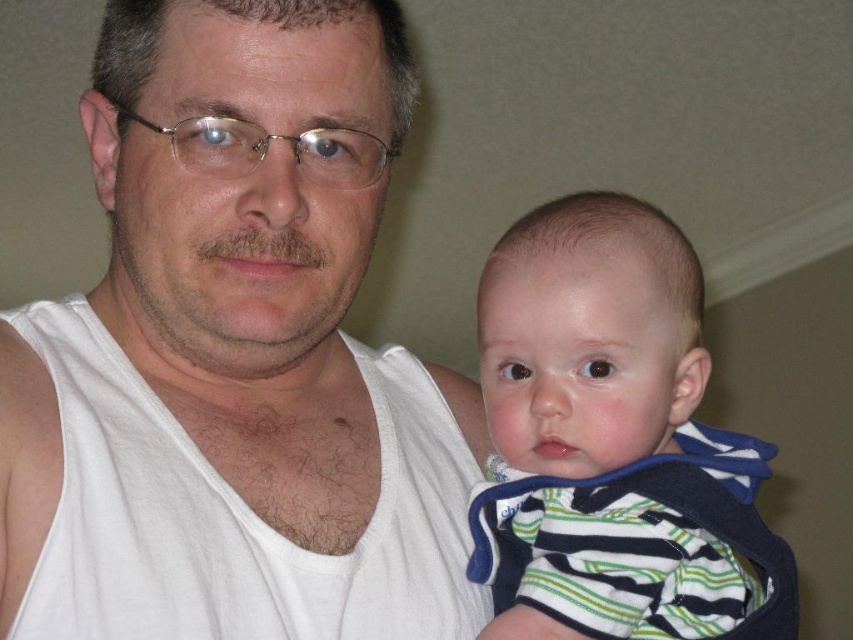
You are standing in the room where the adult male and baby are. You want to place a small sticker on the point that is closer to you. Which point should you choose between point (498, 292) and point (582, 493)?

Point (498, 292) is closer to you than point (582, 493), so you should choose point (498, 292).

You are a clothing designer examining the image of the baby wearing two striped items. Which item is bigger in size between the striped cotton onesie at center and the striped cotton vest at center?

The striped cotton onesie at center has a larger size compared to the striped cotton vest at center.